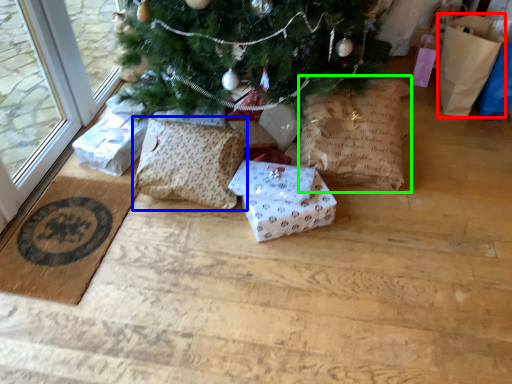
Question: Considering the real-world distances, which object is closest to gift bag (highlighted by a red box)? pillow (highlighted by a blue box) or shopping bag (highlighted by a green box).

Choices:
 (A) pillow
 (B) shopping bag

Answer: (B)